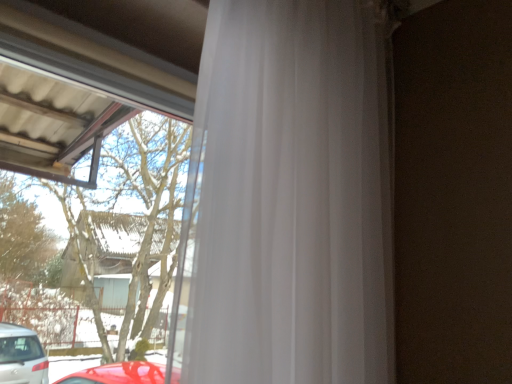
Describe the element at coordinates (288, 199) in the screenshot. I see `white sheer curtain at center` at that location.

Locate an element on the screen. The height and width of the screenshot is (384, 512). white sheer curtain at center is located at coordinates (288, 199).

At what (x,y) coordinates should I click in order to perform the action: click on white sheer curtain at center. Please return your answer as a coordinate pair (x, y). The image size is (512, 384). Looking at the image, I should click on (288, 199).